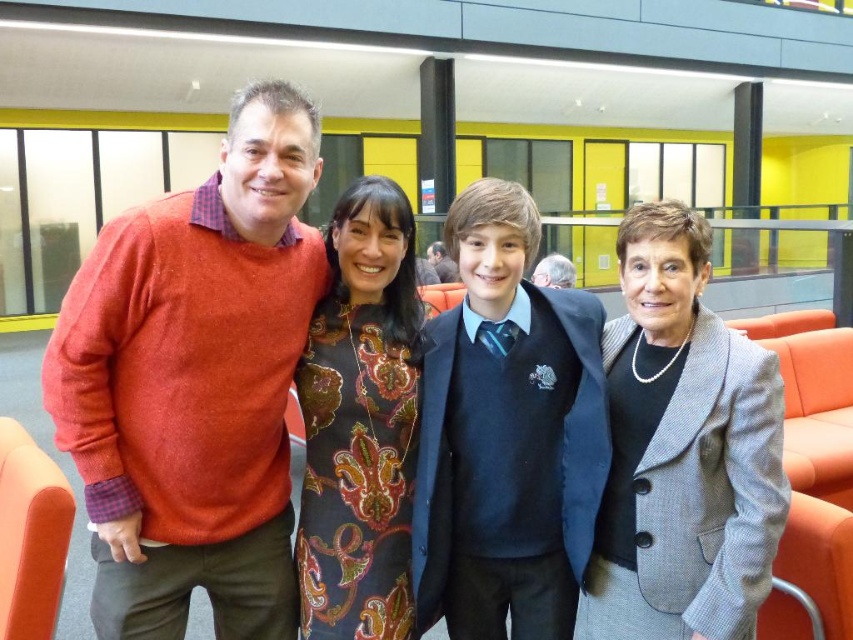
Can you confirm if matte red sweater at left is positioned to the right of matte blue sweater at center?

No, matte red sweater at left is not to the right of matte blue sweater at center.

Between point (190, 397) and point (439, 432), which one is positioned in front?

Positioned in front is point (190, 397).

The width and height of the screenshot is (853, 640). I want to click on matte red sweater at left, so click(x=194, y=384).

Consider the image. Which is more to the left, matte blue sweater at center or paisley-patterned dress at center?

Positioned to the left is paisley-patterned dress at center.

Can you confirm if matte blue sweater at center is positioned below paisley-patterned dress at center?

Yes, matte blue sweater at center is below paisley-patterned dress at center.

This screenshot has height=640, width=853. I want to click on matte blue sweater at center, so click(x=506, y=435).

Based on the photo, who is positioned more to the right, gray woolen blazer at center or gray hair at upper center?

Positioned to the right is gray hair at upper center.

Can you confirm if gray woolen blazer at center is positioned below gray hair at upper center?

Correct, gray woolen blazer at center is located below gray hair at upper center.

Is point (764, 550) in front of point (543, 280)?

Yes, point (764, 550) is in front of point (543, 280).

The image size is (853, 640). What are the coordinates of `gray woolen blazer at center` in the screenshot? It's located at (682, 451).